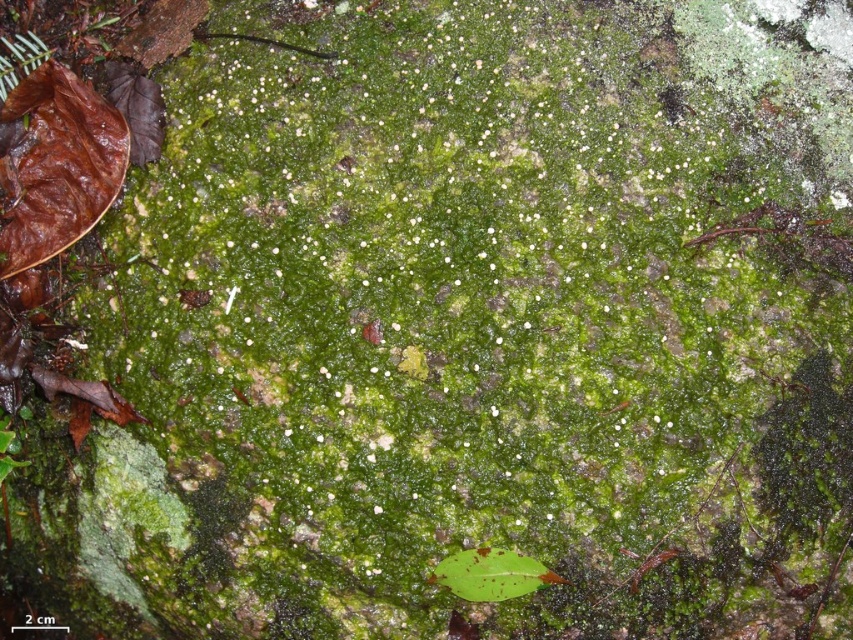
You are examining the mossy surface and notice two leaves. The brown matte leaf at lower left and the green matte leaf at lower center. Which leaf is positioned higher on the surface?

The brown matte leaf at lower left is positioned above the green matte leaf at lower center.